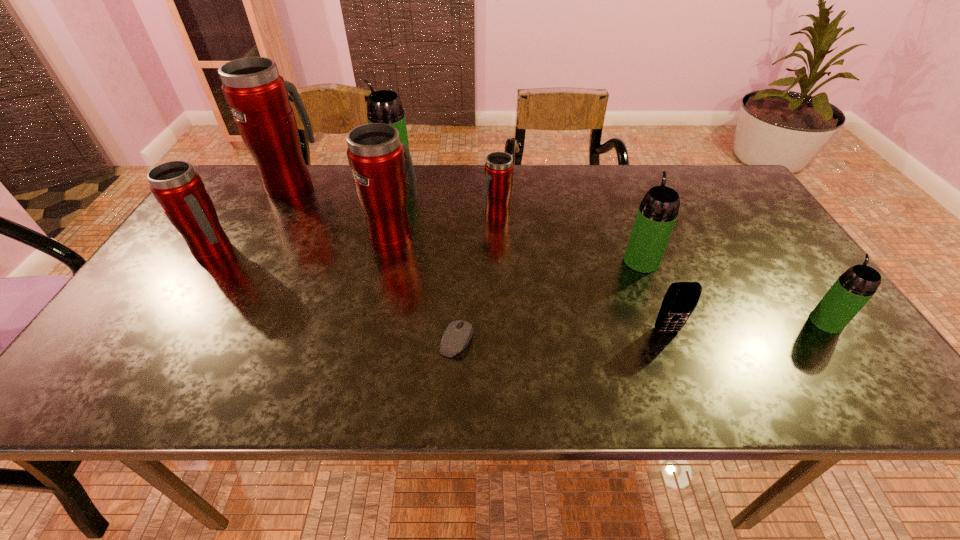
Locate an element on the screen. the biggest red thermos bottle is located at coordinates (258, 97).

In order to click on the farthest red thermos bottle in this screenshot , I will do `click(258, 97)`.

At what (x,y) coordinates should I click in order to perform the action: click on the farthest green thermos bottle. Please return your answer as a coordinate pair (x, y). Image resolution: width=960 pixels, height=540 pixels. Looking at the image, I should click on (384, 106).

What are the coordinates of `the biggest green thermos bottle` in the screenshot? It's located at click(x=384, y=106).

Locate an element on the screen. the second red thermos bottle from right to left is located at coordinates (380, 163).

Find the location of a particular element. This screenshot has width=960, height=540. the second smallest green thermos bottle is located at coordinates (658, 211).

Where is `the second green thermos bottle from left to right`? The width and height of the screenshot is (960, 540). the second green thermos bottle from left to right is located at coordinates (658, 211).

Find the location of `the third biggest red thermos bottle`. the third biggest red thermos bottle is located at coordinates (180, 191).

What are the coordinates of `the smallest green thermos bottle` in the screenshot? It's located at (854, 288).

I want to click on the nearest thermos bottle, so click(854, 288).